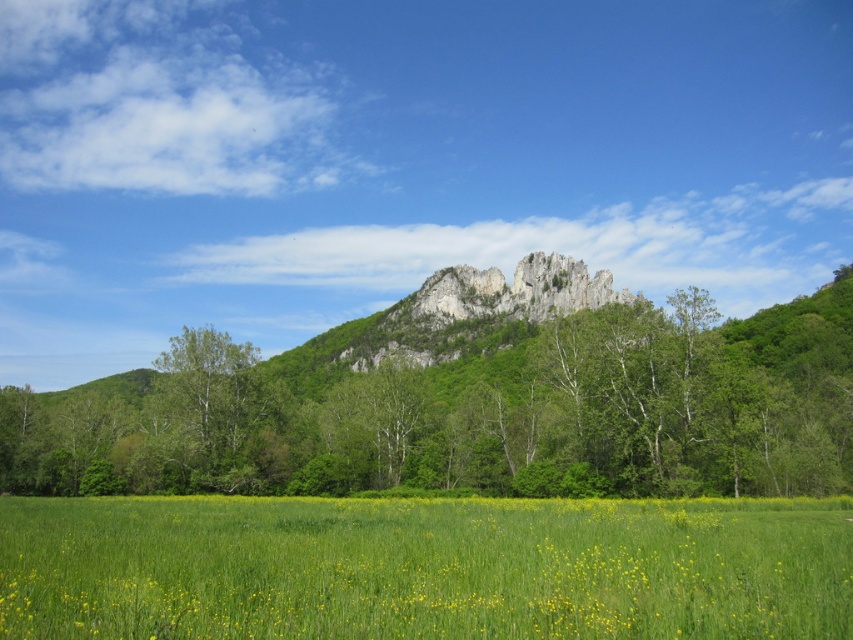
Can you confirm if green leafy tree at center is thinner than green leafy tree at left?

In fact, green leafy tree at center might be wider than green leafy tree at left.

Which is in front, point (595, 467) or point (221, 404)?

Point (595, 467)

Between point (78, 465) and point (158, 413), which one is positioned behind?

Positioned behind is point (158, 413).

Identify the location of green leafy tree at center. (469, 412).

Does point (281, 516) come in front of point (173, 420)?

Yes, it is in front of point (173, 420).

Does green grass at lower center have a lesser height compared to green leafy tree at left?

Yes, green grass at lower center is shorter than green leafy tree at left.

Who is more distant from viewer, (582, 596) or (236, 461)?

Point (236, 461)

At what (x,y) coordinates should I click in order to perform the action: click on green grass at lower center. Please return your answer as a coordinate pair (x, y). Looking at the image, I should click on (422, 568).

Describe the element at coordinates (469, 412) in the screenshot. The height and width of the screenshot is (640, 853). I see `green leafy tree at center` at that location.

Which is in front, point (798, 404) or point (283, 531)?

Point (283, 531)

Who is more forward, (337, 392) or (573, 560)?

Positioned in front is point (573, 560).

Where is `green leafy tree at center`? This screenshot has height=640, width=853. green leafy tree at center is located at coordinates (469, 412).